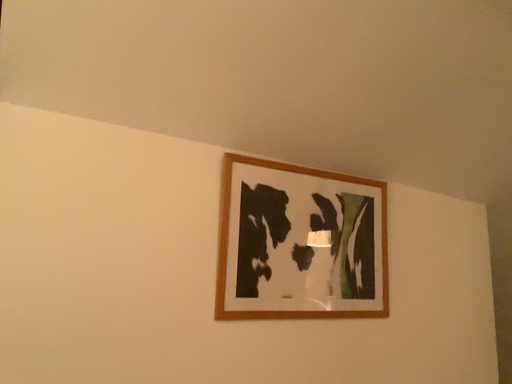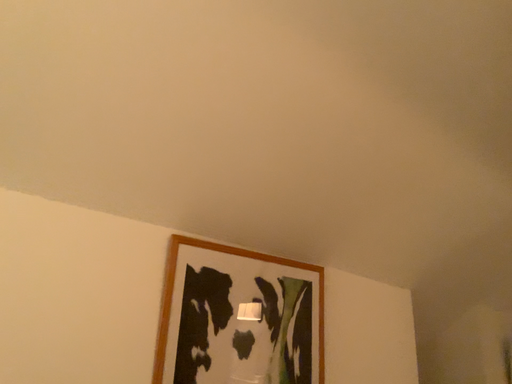
Question: Which way did the camera rotate in the video?

Choices:
 (A) rotated right
 (B) rotated left

Answer: (A)